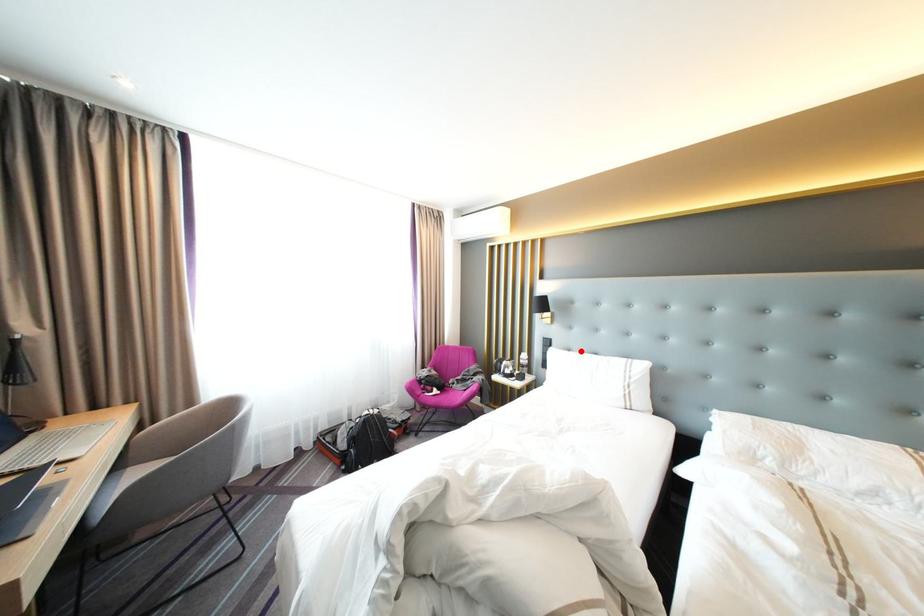
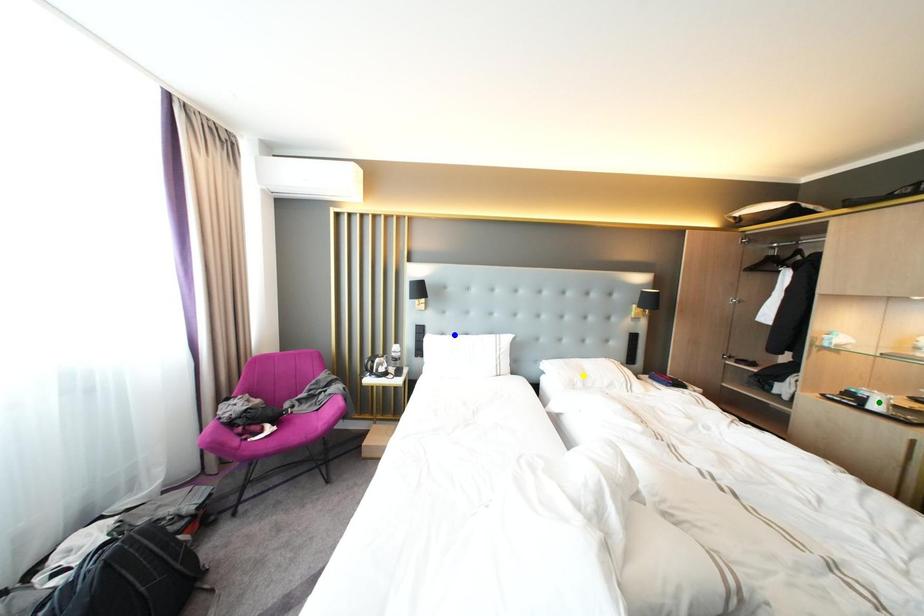
Question: I am providing you with two images of the same scene from different viewpoints. A red point is marked on the first image. You are given multiple points on the second image. Which point in image 2 represents the same 3d spot as the red point in image 1?

Choices:
 (A) blue point
 (B) green point
 (C) yellow point

Answer: (A)